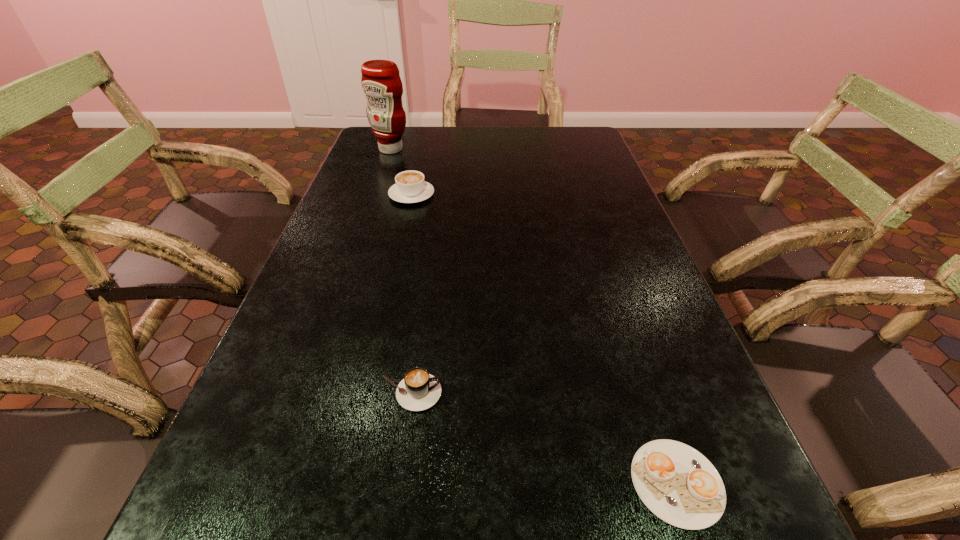
This screenshot has height=540, width=960. Find the location of `condiment`. condiment is located at coordinates (381, 83).

The height and width of the screenshot is (540, 960). In order to click on the tallest object in this screenshot , I will do `click(381, 83)`.

The height and width of the screenshot is (540, 960). What are the coordinates of `the second farthest object` in the screenshot? It's located at (410, 187).

At what (x,y) coordinates should I click in order to perform the action: click on the farthest cappuccino. Please return your answer as a coordinate pair (x, y). This screenshot has width=960, height=540. Looking at the image, I should click on (410, 187).

Locate an element on the screen. The image size is (960, 540). the third tallest object is located at coordinates (419, 390).

You are a GUI agent. You are given a task and a screenshot of the screen. Output one action in this format:
    pyautogui.click(x=<x>, y=<y>)
    Task: Click on the second nearest object
    
    Given the screenshot: What is the action you would take?
    pyautogui.click(x=419, y=390)

At what (x,y) coordinates should I click in order to perform the action: click on the nearest cappuccino. Please return your answer as a coordinate pair (x, y). This screenshot has height=540, width=960. Looking at the image, I should click on (677, 483).

Image resolution: width=960 pixels, height=540 pixels. Identify the location of the nearest object. (677, 483).

Identify the location of vacant area situated on the back of the farthest object. (398, 127).

The width and height of the screenshot is (960, 540). I want to click on blank area located 0.140m on the side of the second farthest object with the handle, so click(420, 161).